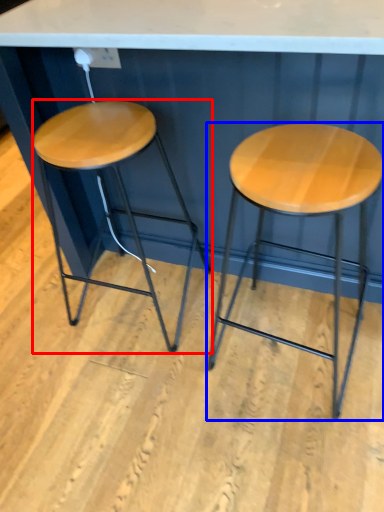
Question: Which object appears farthest to the camera in this image, stool (highlighted by a red box) or stool (highlighted by a blue box)?

Choices:
 (A) stool
 (B) stool

Answer: (A)